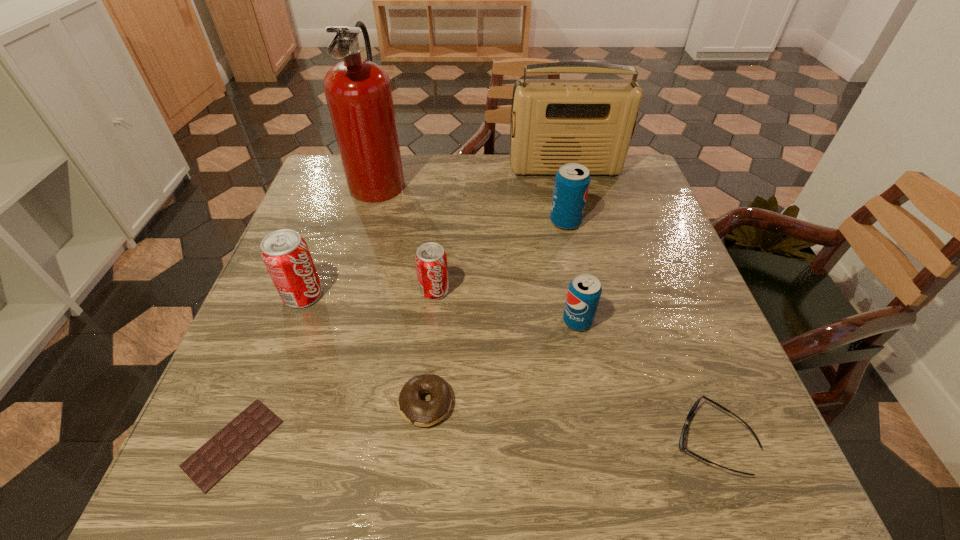
The image size is (960, 540). Find the location of `vacant space that is in between the doughnut and the bigger red soda can`. vacant space that is in between the doughnut and the bigger red soda can is located at coordinates (364, 349).

This screenshot has width=960, height=540. Find the location of `free space that is in between the radio receiver and the smaller blue soda can`. free space that is in between the radio receiver and the smaller blue soda can is located at coordinates (571, 245).

Locate an element on the screen. vacant space in between the second soda can from left to right and the second tallest object is located at coordinates (500, 230).

In order to click on free space that is in between the nearer blue soda can and the blue sunglasses in this screenshot , I will do (x=644, y=381).

In order to click on empty space between the beige radio receiver and the brown doughnut in this screenshot , I will do `click(495, 286)`.

Identify which object is the nearest to the smaller blue soda can. Please provide its 2D coordinates. Your answer should be formatted as a tuple, i.e. [(x, y)], where the tuple contains the x and y coordinates of a point satisfying the conditions above.

[(681, 442)]

The width and height of the screenshot is (960, 540). In order to click on the fourth closest object to the red fire extinguisher in this screenshot , I will do `click(572, 181)`.

The image size is (960, 540). I want to click on soda can that can be found as the closest to the nearer blue soda can, so click(x=431, y=260).

Select which soda can is the third closest to the doughnut. Please provide its 2D coordinates. Your answer should be formatted as a tuple, i.e. [(x, y)], where the tuple contains the x and y coordinates of a point satisfying the conditions above.

[(286, 256)]

Find the location of a particular element. Image resolution: width=960 pixels, height=540 pixels. free space that satisfies the following two spatial constraints: 1. on the back side of the third farthest object; 2. on the right side of the nearer blue soda can is located at coordinates (558, 222).